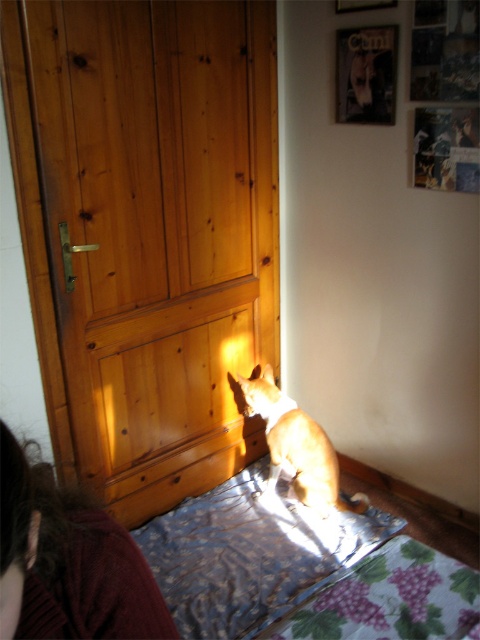
Can you confirm if wooden door at center is wider than brown woolen sweater at lower left?

Correct, the width of wooden door at center exceeds that of brown woolen sweater at lower left.

Is point (46, 147) farther from camera compared to point (83, 608)?

Yes, it is.

Where is `wooden door at center`? Image resolution: width=480 pixels, height=640 pixels. wooden door at center is located at coordinates (147, 230).

Can you confirm if metallic silver bed at center is positioned to the left of brown woolen sweater at lower left?

In fact, metallic silver bed at center is to the right of brown woolen sweater at lower left.

Who is more distant from viewer, (285, 577) or (82, 566)?

The point (285, 577) is more distant.

You are a GUI agent. You are given a task and a screenshot of the screen. Output one action in this format:
    pyautogui.click(x=<x>, y=<y>)
    Task: Click on the metallic silver bed at center
    
    Given the screenshot: What is the action you would take?
    pyautogui.click(x=249, y=556)

Is wooden door at center below brown fur cat at center?

No, wooden door at center is not below brown fur cat at center.

Between point (181, 497) and point (248, 385), which one is positioned in front?

Point (181, 497)

You are a GUI agent. You are given a task and a screenshot of the screen. Output one action in this format:
    pyautogui.click(x=<x>, y=<y>)
    Task: Click on the wooden door at center
    The image size is (480, 640).
    Given the screenshot: What is the action you would take?
    pyautogui.click(x=147, y=230)